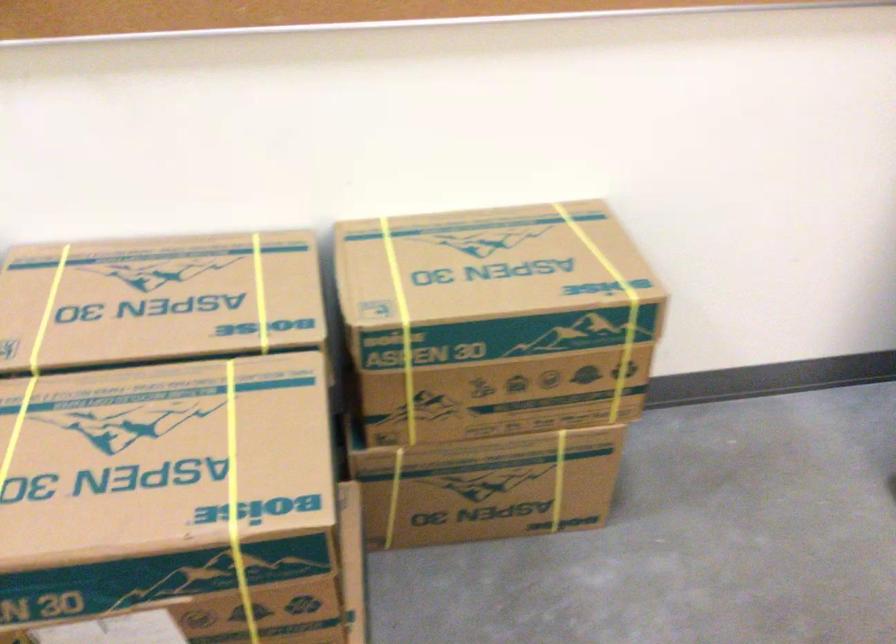
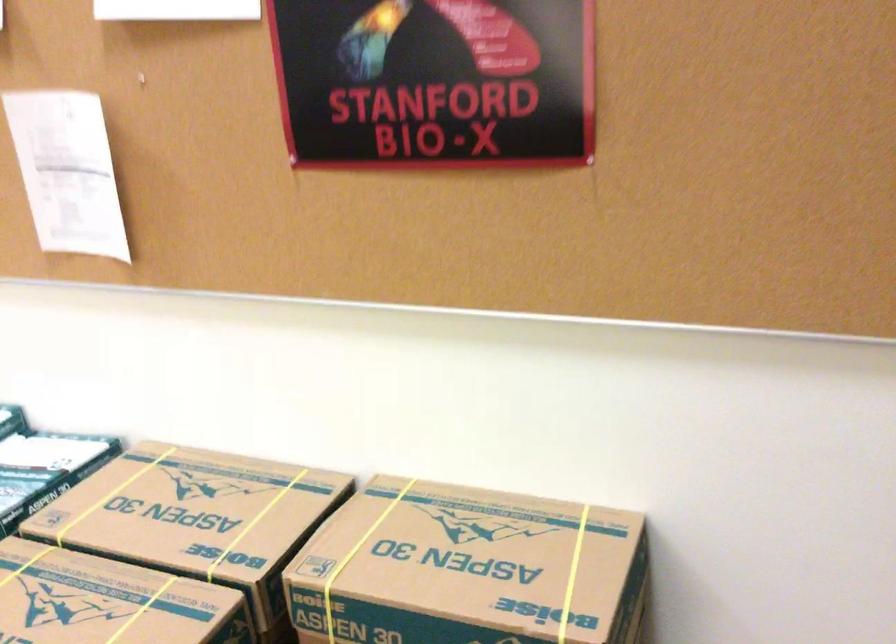
In the second image, find the point that corresponds to (601,256) in the first image.

(572, 574)